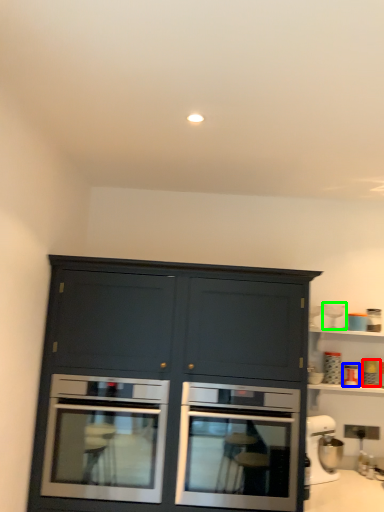
Question: Considering the real-world distances, which object is farthest from appliance (highlighted by a red box)? appliance (highlighted by a blue box) or appliance (highlighted by a green box)?

Choices:
 (A) appliance
 (B) appliance

Answer: (B)